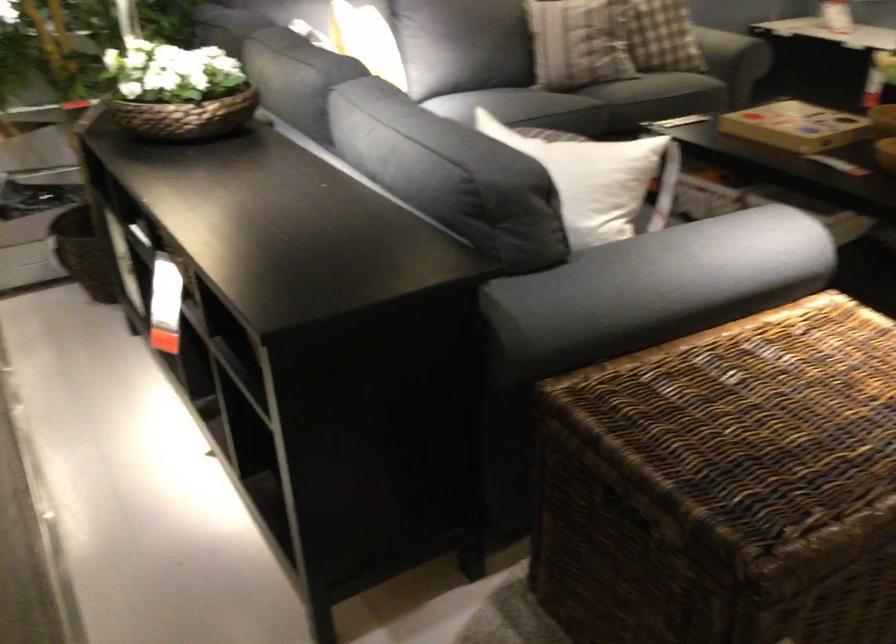
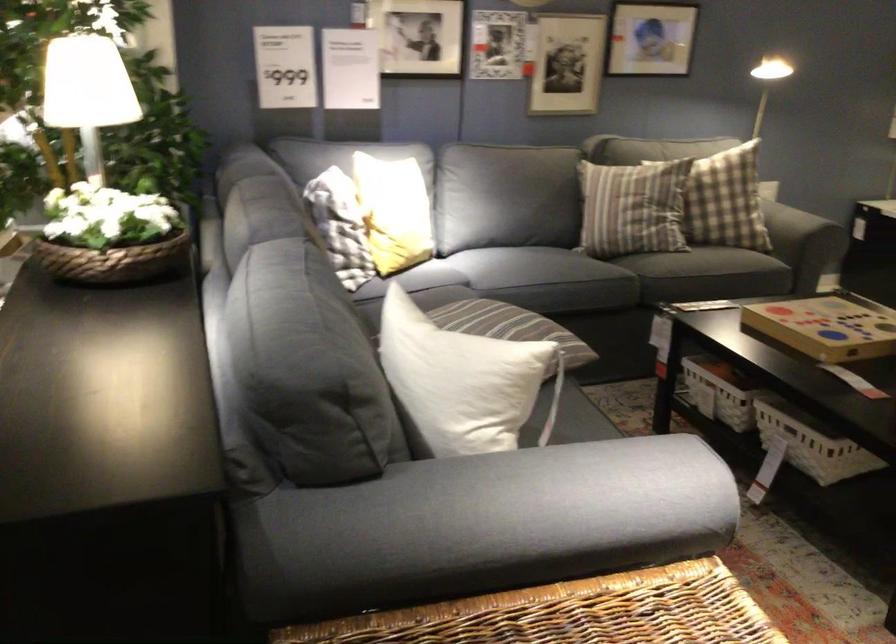
Question: The camera is either moving clockwise (left) or counter-clockwise (right) around the object. The first image is from the beginning of the video and the second image is from the end. Is the camera moving left or right when shooting the video?

Choices:
 (A) Left
 (B) Right

Answer: (B)